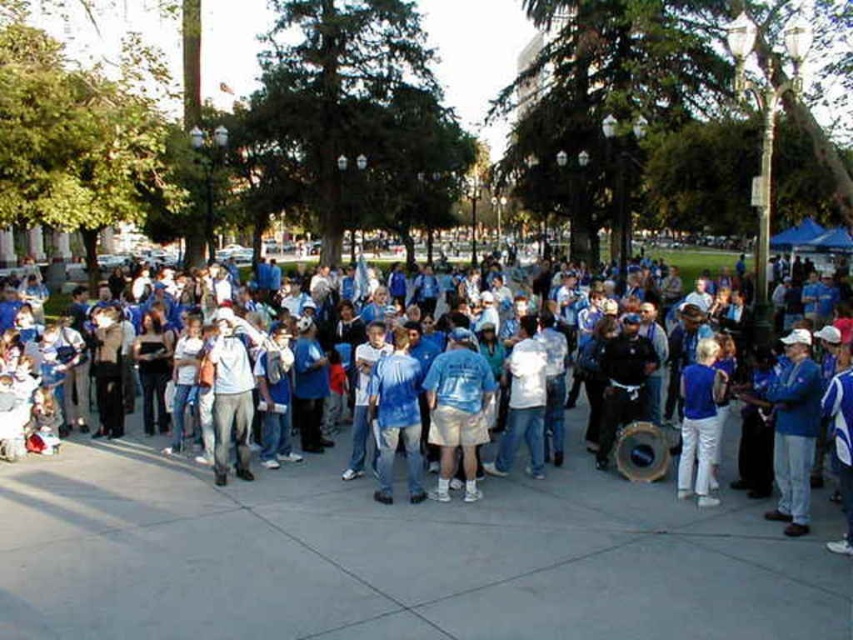
Is light blue t-shirt at center positioned before blue cotton shirt at center?

No, it is not.

Can you confirm if light blue t-shirt at center is thinner than blue cotton shirt at center?

Incorrect, light blue t-shirt at center's width is not less than blue cotton shirt at center's.

The width and height of the screenshot is (853, 640). What do you see at coordinates (457, 410) in the screenshot? I see `light blue t-shirt at center` at bounding box center [457, 410].

The image size is (853, 640). What are the coordinates of `light blue t-shirt at center` in the screenshot? It's located at (457, 410).

Does light blue t-shirt at center appear under blue tie-dye shirt at center?

Actually, light blue t-shirt at center is above blue tie-dye shirt at center.

Describe the element at coordinates (457, 410) in the screenshot. I see `light blue t-shirt at center` at that location.

Where is `light blue t-shirt at center`? The image size is (853, 640). light blue t-shirt at center is located at coordinates (457, 410).

Is point (722, 444) less distant than point (395, 340)?

That is False.

What do you see at coordinates (728, 410) in the screenshot?
I see `blue cotton shirts at center` at bounding box center [728, 410].

In order to click on blue cotton shirts at center in this screenshot , I will do `click(728, 410)`.